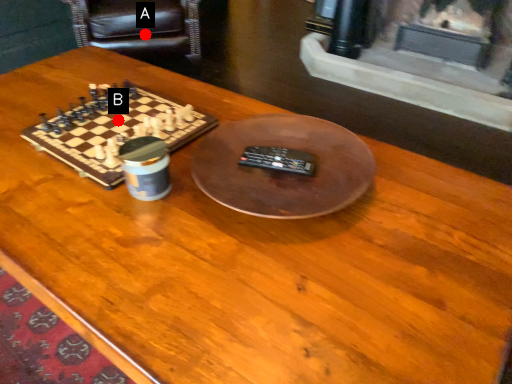
Question: Two points are circled on the image, labeled by A and B beside each circle. Which point appears closest to the camera in this image?

Choices:
 (A) A is closer
 (B) B is closer

Answer: (B)